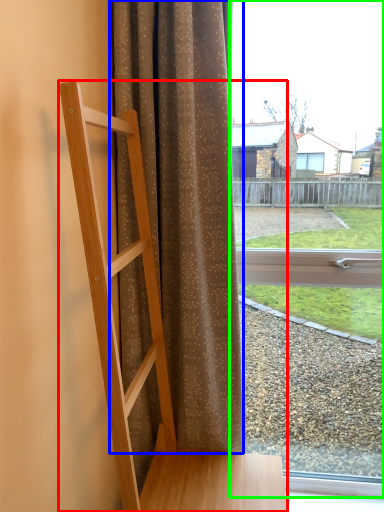
Question: Considering the real-world distances, which object is farthest from furniture (highlighted by a red box)? curtain (highlighted by a blue box) or window (highlighted by a green box)?

Choices:
 (A) curtain
 (B) window

Answer: (B)